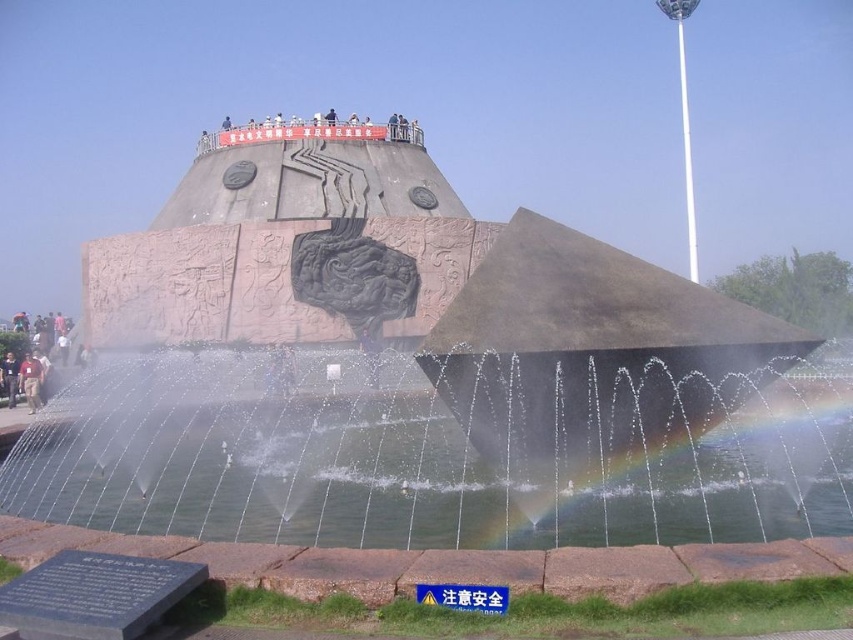
Does metallic fountain at center have a greater width compared to clear water at fountain center?

Correct, the width of metallic fountain at center exceeds that of clear water at fountain center.

Is metallic fountain at center smaller than clear water at fountain center?

Actually, metallic fountain at center might be larger than clear water at fountain center.

Describe the element at coordinates (416, 372) in the screenshot. This screenshot has height=640, width=853. I see `metallic fountain at center` at that location.

At what (x,y) coordinates should I click in order to perform the action: click on metallic fountain at center. Please return your answer as a coordinate pair (x, y). Image resolution: width=853 pixels, height=640 pixels. Looking at the image, I should click on (416, 372).